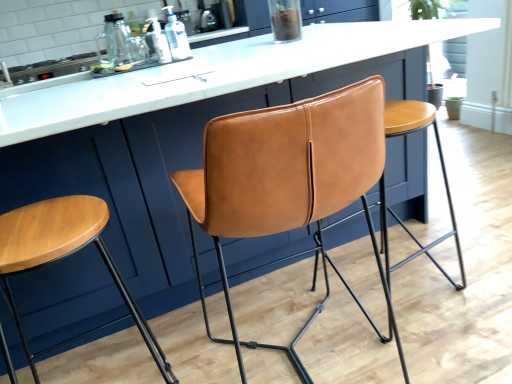
I want to click on free point behind matte leather stool at center, which is the 1th stool in right-to-left order, so click(388, 240).